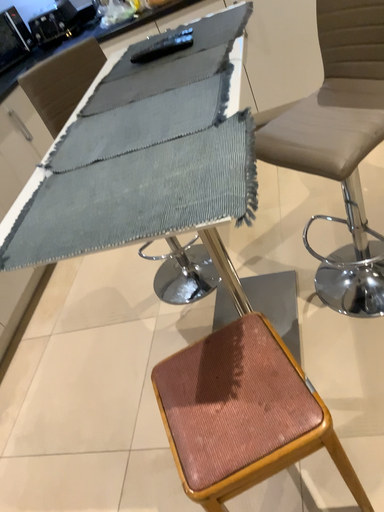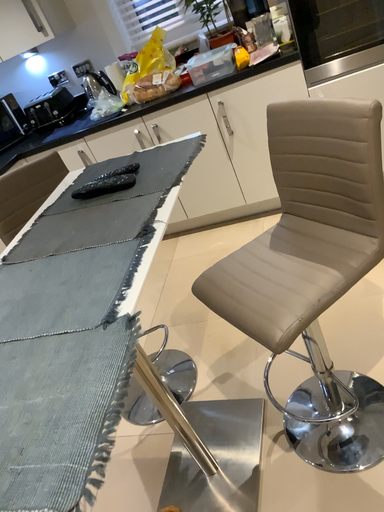
Question: Which way did the camera rotate in the video?

Choices:
 (A) rotated upward
 (B) rotated downward

Answer: (A)